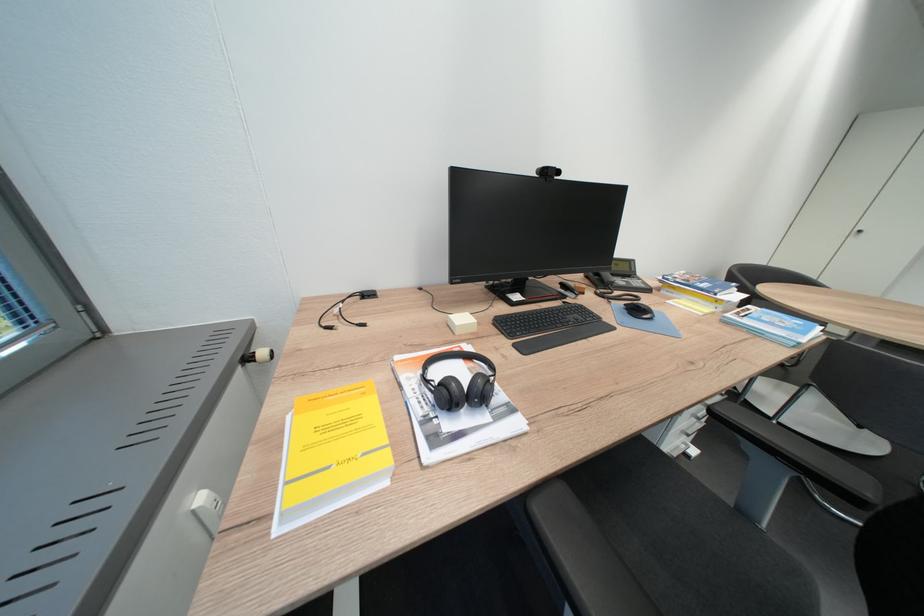
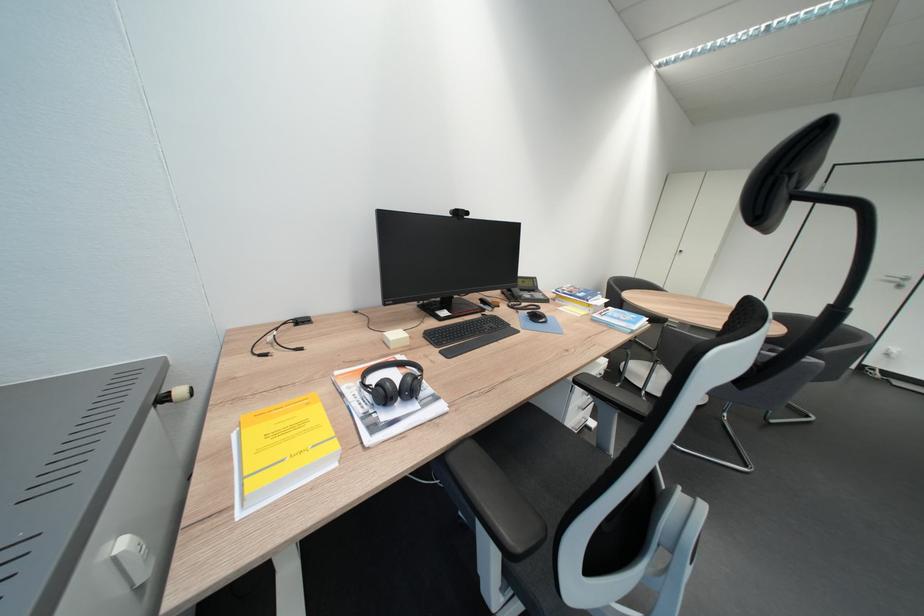
Find the pixel in the second image that matches (560,169) in the first image.

(469, 211)